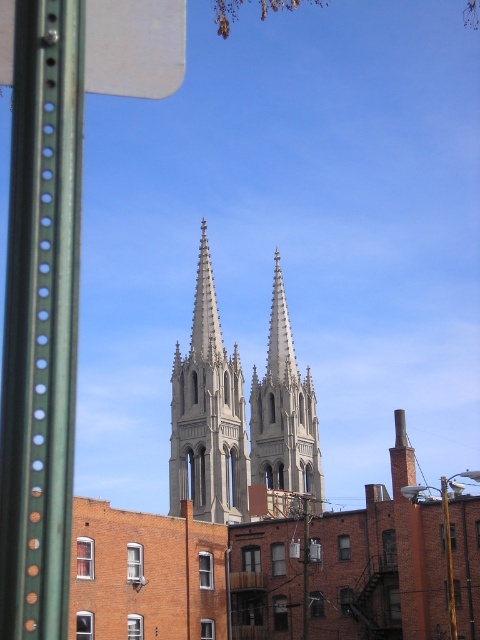
What is the 2D coordinate of the gray stone spire at center in the image?

The gray stone spire at center is located at the 2D coordinate point of [207,413].

You are standing in front of the historic church and modern buildings. You see two points marked in the image. Which point is closer to you, point 1 at coordinates point (175, 403) or point 2 at coordinates point (296, 444)?

Point 1 at coordinates point (175, 403) is closer to you than point 2 at coordinates point (296, 444).